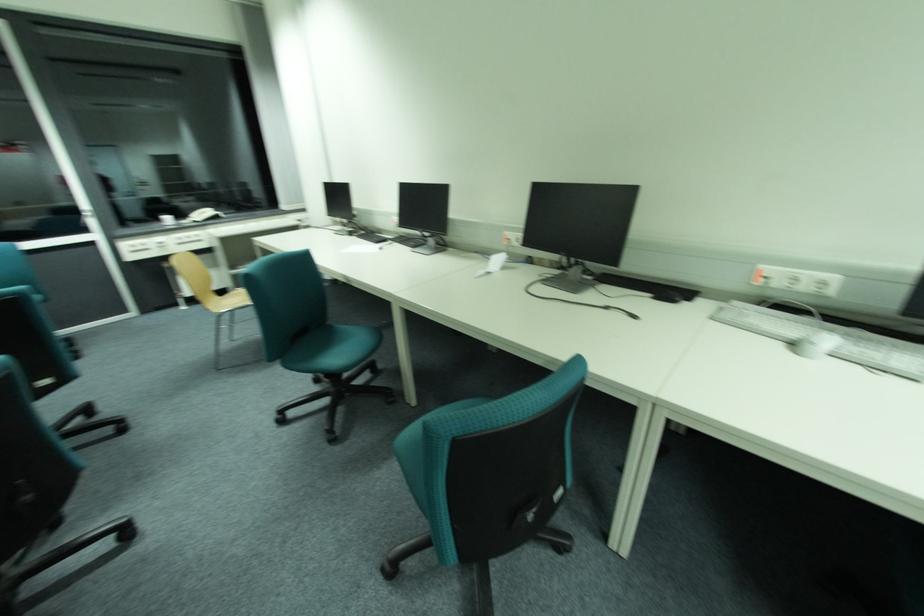
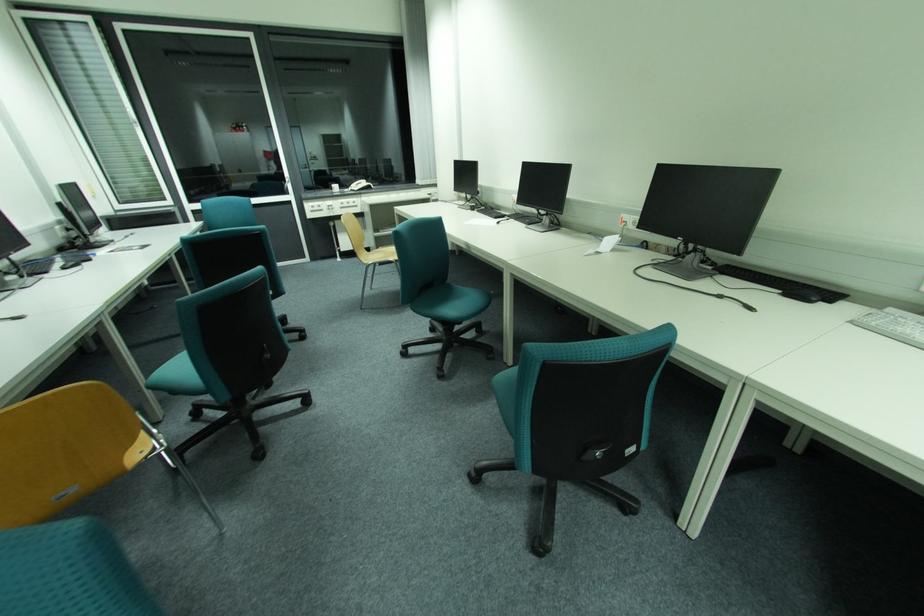
Question: The images are taken continuously from a first-person perspective. In which direction is your viewpoint rotating?

Choices:
 (A) Left
 (B) Right
 (C) Up
 (D) Down

Answer: (A)